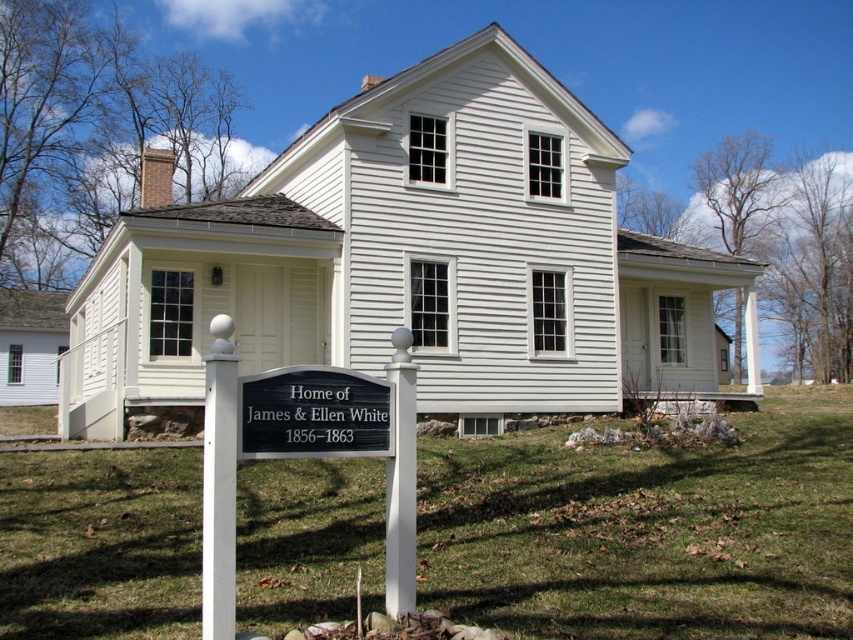
Consider the image. Can you confirm if white siding house at center is positioned to the left of black metal sign at lower center?

Correct, you'll find white siding house at center to the left of black metal sign at lower center.

Who is taller, white siding house at center or black metal sign at lower center?

white siding house at center

You are a GUI agent. You are given a task and a screenshot of the screen. Output one action in this format:
    pyautogui.click(x=<x>, y=<y>)
    Task: Click on the white siding house at center
    
    Given the screenshot: What is the action you would take?
    pyautogui.click(x=410, y=260)

Can you confirm if black metal sign at lower center is positioned above black polished sign at center?

Incorrect, black metal sign at lower center is not positioned above black polished sign at center.

Is black metal sign at lower center below black polished sign at center?

Yes, black metal sign at lower center is below black polished sign at center.

This screenshot has height=640, width=853. Identify the location of black metal sign at lower center. (303, 452).

Is point (604, 176) closer to viewer compared to point (337, 371)?

No, (604, 176) is further to viewer.

Can you confirm if white siding house at center is smaller than black polished sign at center?

Actually, white siding house at center might be larger than black polished sign at center.

Image resolution: width=853 pixels, height=640 pixels. What do you see at coordinates (410, 260) in the screenshot? I see `white siding house at center` at bounding box center [410, 260].

Locate an element on the screen. This screenshot has height=640, width=853. white siding house at center is located at coordinates click(x=410, y=260).